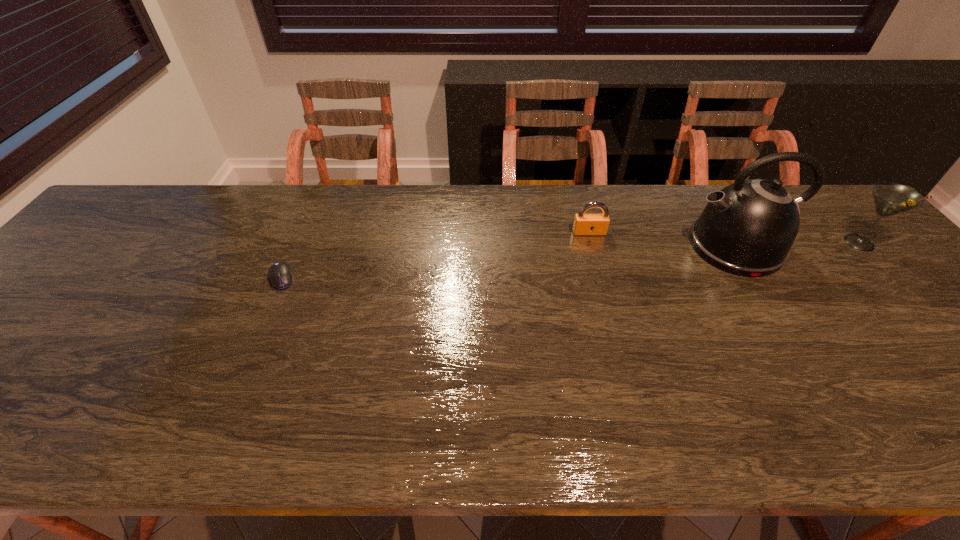
In the image, there is a desktop. In order to click on vacant space at the near edge in this screenshot , I will do `click(307, 434)`.

Locate an element on the screen. This screenshot has height=540, width=960. vacant space at the left edge of the desktop is located at coordinates (29, 314).

Identify the location of free space at the right edge. This screenshot has width=960, height=540. (893, 289).

Locate an element on the screen. The width and height of the screenshot is (960, 540). free space between the shortest object and the third object from left to right is located at coordinates (509, 262).

Locate an element on the screen. This screenshot has height=540, width=960. vacant space that's between the third tallest object and the tallest object is located at coordinates tap(662, 240).

This screenshot has height=540, width=960. Identify the location of blank region between the second object from right to left and the third object from right to left. (662, 240).

Where is `blank region between the second shortest object and the shortest object`? The width and height of the screenshot is (960, 540). blank region between the second shortest object and the shortest object is located at coordinates (436, 255).

Identify the location of free space between the shortest object and the second object from right to left. Image resolution: width=960 pixels, height=540 pixels. (509, 262).

The width and height of the screenshot is (960, 540). What are the coordinates of `free area in between the shortest object and the tallest object` in the screenshot? It's located at (509, 262).

At what (x,y) coordinates should I click in order to perform the action: click on unoccupied position between the rightmost object and the shortest object. Please return your answer as a coordinate pair (x, y). The image size is (960, 540). Looking at the image, I should click on (570, 260).